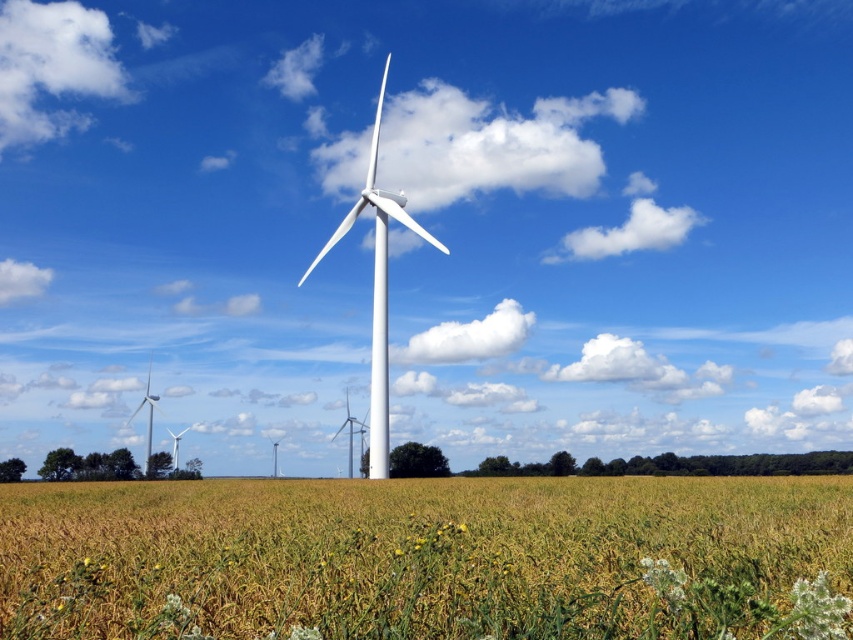
Question: Which point is closer to the camera taking this photo?

Choices:
 (A) (142, 404)
 (B) (401, 205)

Answer: (B)

Question: Where is yellow grass at center located in relation to white matte wind turbine at center in the image?

Choices:
 (A) above
 (B) below

Answer: (B)

Question: Which point is closer to the camera?

Choices:
 (A) white matte windmill at left
 (B) white matte wind turbine at center

Answer: (B)

Question: Among these objects, which one is nearest to the camera?

Choices:
 (A) white matte wind turbine at center
 (B) yellow grass at center
 (C) white matte windmill at left

Answer: (B)

Question: Is yellow grass at center smaller than white matte wind turbine at center?

Choices:
 (A) yes
 (B) no

Answer: (A)

Question: Does yellow grass at center appear on the right side of white matte wind turbine at center?

Choices:
 (A) no
 (B) yes

Answer: (B)